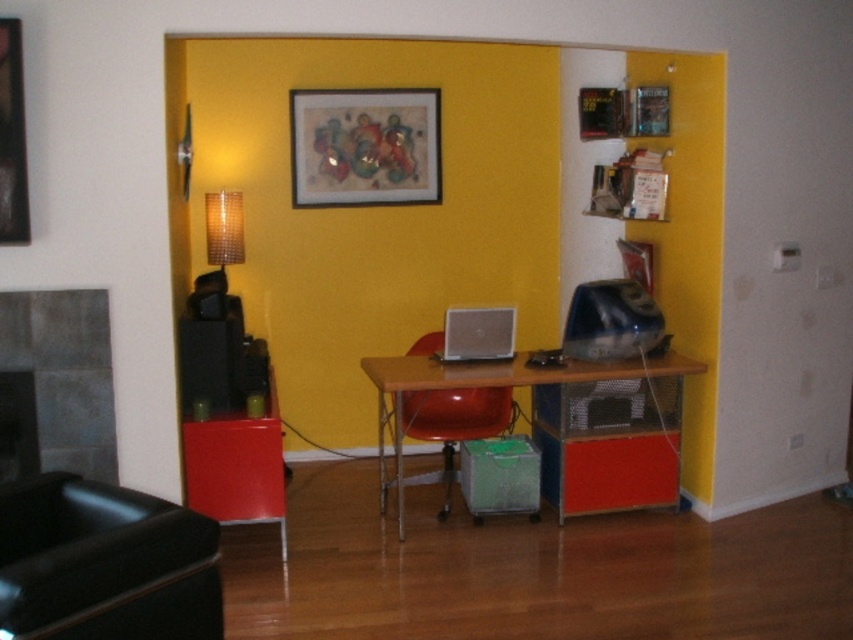
Question: Considering the real-world distances, which object is farthest from the wooden desk at center?

Choices:
 (A) woven fabric lampshade at left
 (B) matte wooden picture frame at upper center
 (C) matte red chair at center
 (D) silver metallic laptop at center

Answer: (B)

Question: Which of the following is the closest to the observer?

Choices:
 (A) (16, 365)
 (B) (508, 308)
 (C) (469, 440)
 (D) (553, 371)

Answer: (A)

Question: From the image, what is the correct spatial relationship of silver metallic laptop at center in relation to woven fabric lampshade at left?

Choices:
 (A) below
 (B) above

Answer: (A)

Question: Is gray stone fireplace at left above silver metallic laptop at center?

Choices:
 (A) yes
 (B) no

Answer: (B)

Question: Is gray stone fireplace at left in front of matte red chair at center?

Choices:
 (A) yes
 (B) no

Answer: (A)

Question: Which point appears farthest from the camera in this image?

Choices:
 (A) (445, 474)
 (B) (218, 225)
 (C) (15, 618)

Answer: (B)